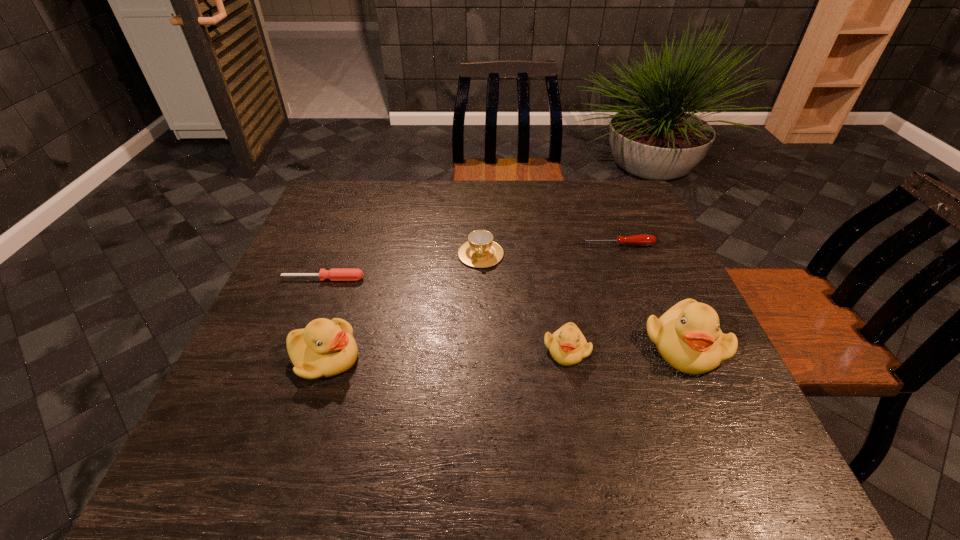
Locate an element on the screen. This screenshot has height=540, width=960. vacant space that satisfies the following two spatial constraints: 1. with the handle on the side of the cup; 2. at the face of the second tallest object is located at coordinates (481, 357).